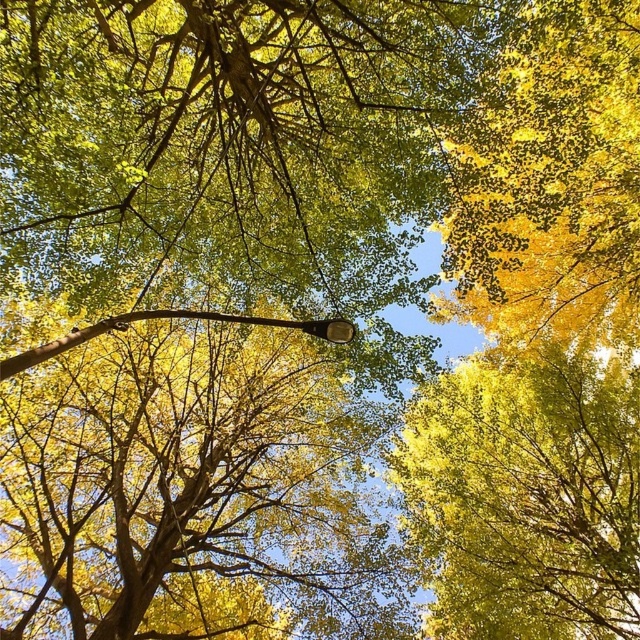
Does smooth brown tree trunk at center have a smaller size compared to yellow-green leaves at upper center?

Indeed, smooth brown tree trunk at center has a smaller size compared to yellow-green leaves at upper center.

Measure the distance between point (324, 355) and camera.

Point (324, 355) is 8.70 meters away from camera.

Does point (189, 392) lie behind point (412, 461)?

Yes.

Find the location of a particular element. This screenshot has width=640, height=640. smooth brown tree trunk at center is located at coordinates (188, 486).